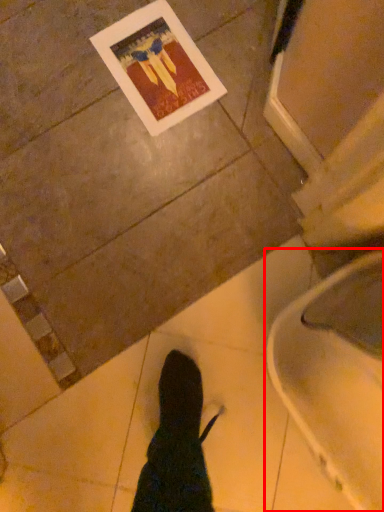
Question: From the image's perspective, what is the correct spatial positioning of toilet (annotated by the red box) in reference to postcard?

Choices:
 (A) above
 (B) below

Answer: (B)